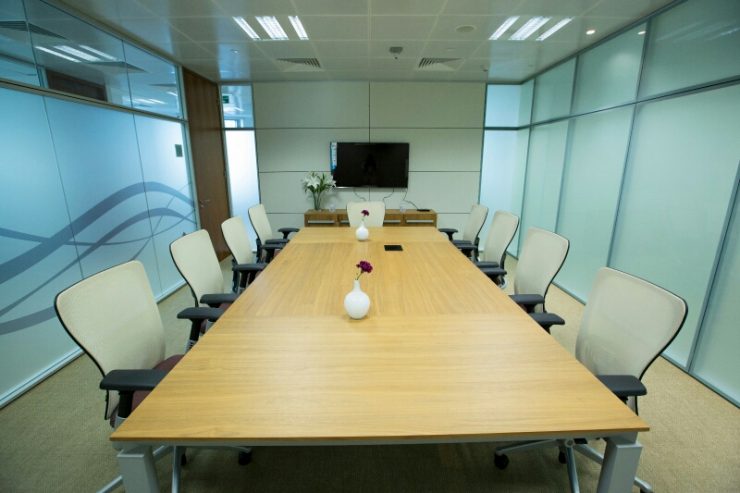
Identify the location of curvy lines on wall. (107, 205), (132, 219), (18, 235), (38, 319).